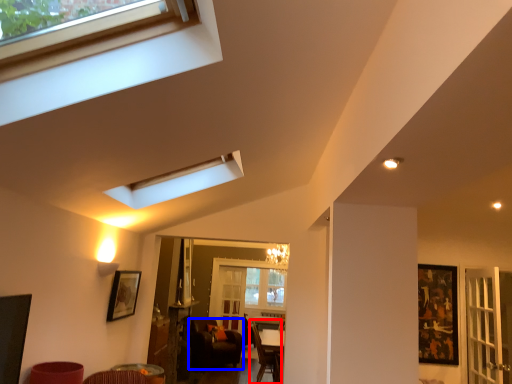
Question: Which object is closer to the camera taking this photo, armchair (highlighted by a red box) or chair (highlighted by a blue box)?

Choices:
 (A) armchair
 (B) chair

Answer: (A)